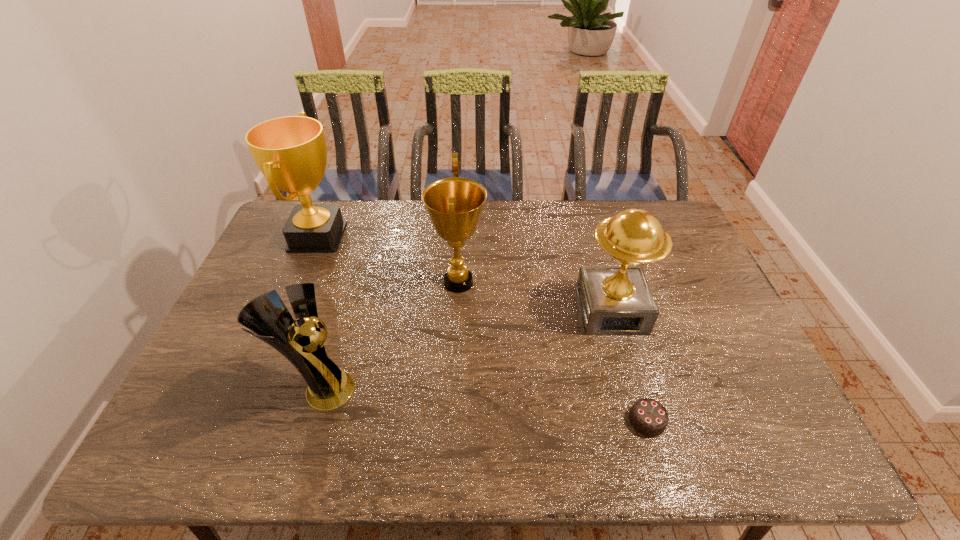
Locate an element on the screen. The height and width of the screenshot is (540, 960). chocolate cake at the near edge is located at coordinates (647, 416).

I want to click on object that is at the left edge, so click(x=291, y=152).

Identify the location of object present at the far left corner. (291, 152).

Identify the location of free space at the far edge. This screenshot has width=960, height=540. (508, 210).

In the image, there is a desktop. At what (x,y) coordinates should I click in order to perform the action: click on vacant area at the near edge. Please return your answer as a coordinate pair (x, y). Image resolution: width=960 pixels, height=540 pixels. Looking at the image, I should click on (722, 457).

This screenshot has height=540, width=960. Find the location of `vacant space at the left edge of the desktop`. vacant space at the left edge of the desktop is located at coordinates (284, 257).

The height and width of the screenshot is (540, 960). Find the location of `free space at the right edge of the desktop`. free space at the right edge of the desktop is located at coordinates (670, 256).

The height and width of the screenshot is (540, 960). In the image, there is a desktop. In order to click on vacant area at the far right corner in this screenshot , I will do `click(677, 220)`.

This screenshot has width=960, height=540. Find the location of `vacant area that lies between the third award from left to right and the nearest award`. vacant area that lies between the third award from left to right and the nearest award is located at coordinates (390, 336).

The image size is (960, 540). I want to click on free space between the rightmost award and the third award from left to right, so click(535, 296).